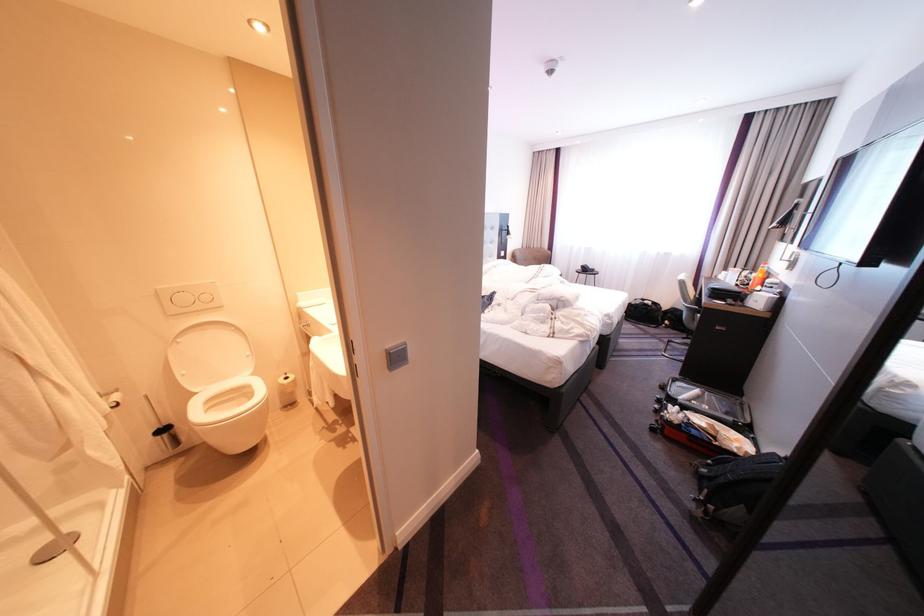
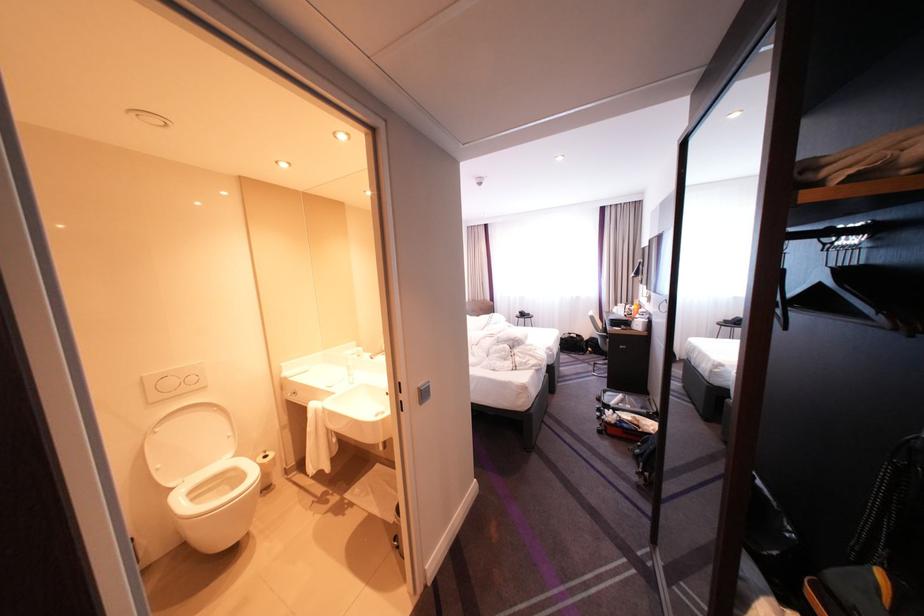
Find the pixel in the second image that matches pixel 207 391 in the first image.

(183, 485)